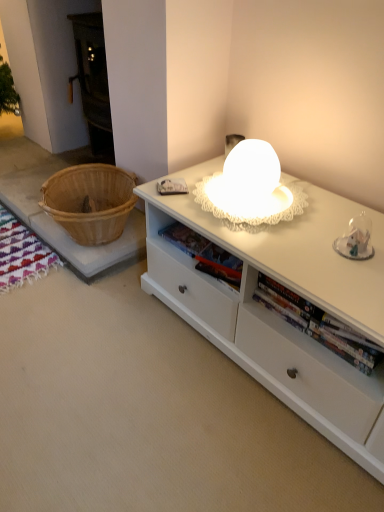
This screenshot has height=512, width=384. What do you see at coordinates (275, 314) in the screenshot?
I see `white matte cabinet at center` at bounding box center [275, 314].

Identify the location of white matte cabinet at center. (275, 314).

The height and width of the screenshot is (512, 384). What do you see at coordinates (185, 239) in the screenshot?
I see `hardcover book at center` at bounding box center [185, 239].

Measure the distance between point (167, 236) and camera.

They are 1.54 meters apart.

What are the coordinates of `hardcover book at center` in the screenshot? It's located at (185, 239).

The height and width of the screenshot is (512, 384). I want to click on white matte cabinet at center, so click(275, 314).

Which object is positioned more to the right, white matte cabinet at center or hardcover book at center?

hardcover book at center is more to the right.

In the image, is white matte cabinet at center positioned in front of or behind hardcover book at center?

white matte cabinet at center is positioned closer to the viewer than hardcover book at center.

Is point (291, 388) farther from camera compared to point (186, 242)?

No, (291, 388) is in front of (186, 242).

From the image's perspective, which is below, white matte cabinet at center or hardcover book at center?

hardcover book at center.

From a real-world perspective, is white matte cabinet at center on top of hardcover book at center?

No, from a real-world perspective, white matte cabinet at center is not above hardcover book at center.

Which of these two, white matte cabinet at center or hardcover book at center, is wider?

Wider between the two is white matte cabinet at center.

Who is shorter, white matte cabinet at center or hardcover book at center?

With less height is hardcover book at center.

Considering the relative sizes of white matte cabinet at center and hardcover book at center in the image provided, is white matte cabinet at center smaller than hardcover book at center?

No, white matte cabinet at center is not smaller than hardcover book at center.

Is white matte cabinet at center completely or partially outside of hardcover book at center?

Yes, white matte cabinet at center is not within hardcover book at center.

Is white matte cabinet at center not near hardcover book at center?

No, white matte cabinet at center is not far away from hardcover book at center.

Is white matte cabinet at center facing towards hardcover book at center?

No, white matte cabinet at center is not facing towards hardcover book at center.

Based on the photo, measure the distance from white matte cabinet at center to hardcover book at center.

white matte cabinet at center and hardcover book at center are 12.77 inches apart from each other.

Locate an element on the screen. book on the right of white matte cabinet at center is located at coordinates (185, 239).

Considering the positions of objects hardcover book at center and white matte cabinet at center in the image provided, who is more to the left, hardcover book at center or white matte cabinet at center?

Positioned to the left is white matte cabinet at center.

Is hardcover book at center further to the viewer compared to white matte cabinet at center?

Yes, it is behind white matte cabinet at center.

From the picture: Which point is more forward, (184, 226) or (381, 405)?

The point (381, 405) is closer.

From the image's perspective, would you say hardcover book at center is shown under white matte cabinet at center?

Yes, from the image's perspective, hardcover book at center is beneath white matte cabinet at center.

From a real-world perspective, which is physically above, hardcover book at center or white matte cabinet at center?

hardcover book at center, from a real-world perspective.

Is hardcover book at center wider than white matte cabinet at center?

Incorrect, the width of hardcover book at center does not surpass that of white matte cabinet at center.

Does hardcover book at center have a lesser height compared to white matte cabinet at center?

Indeed, hardcover book at center has a lesser height compared to white matte cabinet at center.

Between hardcover book at center and white matte cabinet at center, which one has smaller size?

With smaller size is hardcover book at center.

Is white matte cabinet at center completely or partially inside hardcover book at center?

No, hardcover book at center does not contain white matte cabinet at center.

Is hardcover book at center far from white matte cabinet at center?

No.

Is hardcover book at center facing towards white matte cabinet at center?

No, hardcover book at center does not turn towards white matte cabinet at center.

What's the angular difference between hardcover book at center and white matte cabinet at center's facing directions?

hardcover book at center and white matte cabinet at center are facing 5.73 degrees away from each other.

I want to click on book below the white matte cabinet at center (from the image's perspective), so click(185, 239).

The image size is (384, 512). Find the location of `desk lying on the left of hardcover book at center`. desk lying on the left of hardcover book at center is located at coordinates (275, 314).

You are a GUI agent. You are given a task and a screenshot of the screen. Output one action in this format:
    pyautogui.click(x=<x>, y=<y>)
    Task: Click on the desk in front of the hardcover book at center
    
    Given the screenshot: What is the action you would take?
    pyautogui.click(x=275, y=314)